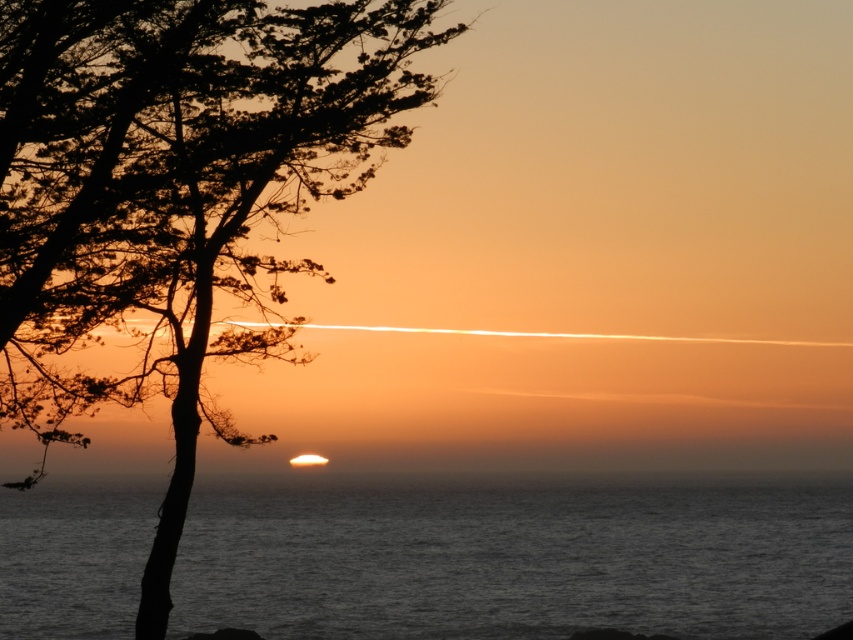
Question: Is the position of silhouette wood at left less distant than that of dark gray water at center?

Choices:
 (A) no
 (B) yes

Answer: (B)

Question: Which point is closer to the camera?

Choices:
 (A) silhouette wood at left
 (B) dark gray water at center

Answer: (A)

Question: Does silhouette wood at left appear under dark gray water at center?

Choices:
 (A) yes
 (B) no

Answer: (B)

Question: Which point is closer to the camera?

Choices:
 (A) (527, 490)
 (B) (242, 352)

Answer: (B)

Question: Where is silhouette wood at left located in relation to dark gray water at center in the image?

Choices:
 (A) left
 (B) right

Answer: (B)